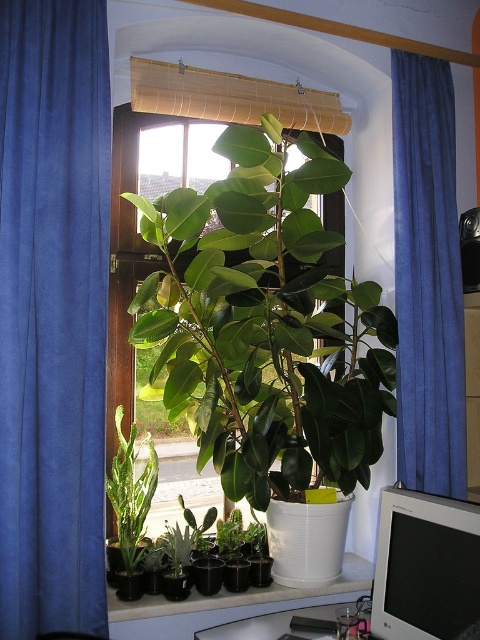
You are a plant enthusiast who wants to arrange your collection. You have a green matte succulent at lower left and a white plastic at center. Which one should you place in a larger pot to accommodate its size?

The green matte succulent at lower left is larger in size than the white plastic at center, so you should place the green matte succulent at lower left in a larger pot to accommodate its size.

Looking at this image, you are arranging a small shelf in the corner of the room. You have a green matte succulent at lower left and a white plastic at center. Which object should you place on the left side of the shelf to match the arrangement in the image?

You should place the green matte succulent at lower left on the left side of the shelf because in the image, the green matte succulent at lower left is positioned to the left of the white plastic at center.